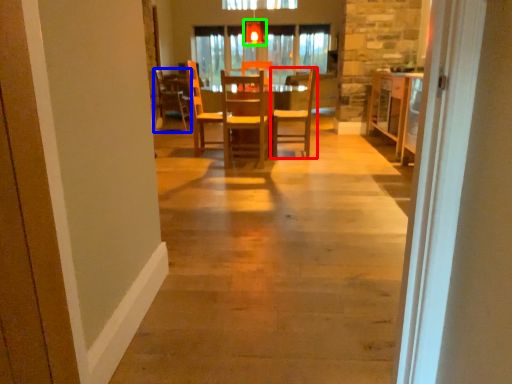
Question: Which is nearer to the chair (highlighted by a red box)? chair (highlighted by a blue box) or light fixture (highlighted by a green box).

Choices:
 (A) chair
 (B) light fixture

Answer: (B)